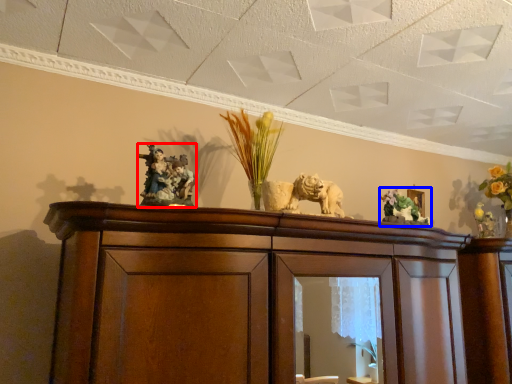
Question: Which of the following is the farthest to the observer, animal (highlighted by a red box) or floral arrangement (highlighted by a blue box)?

Choices:
 (A) animal
 (B) floral arrangement

Answer: (B)